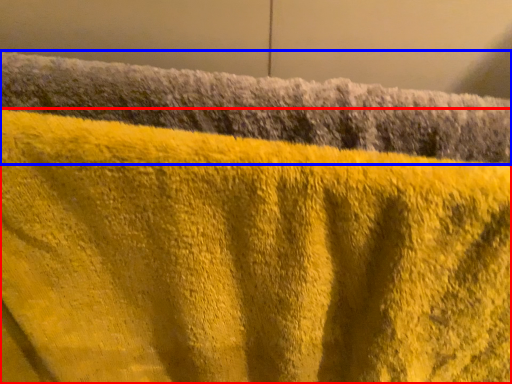
Question: Which object is closer to the camera taking this photo, towel (highlighted by a red box) or towel (highlighted by a blue box)?

Choices:
 (A) towel
 (B) towel

Answer: (A)